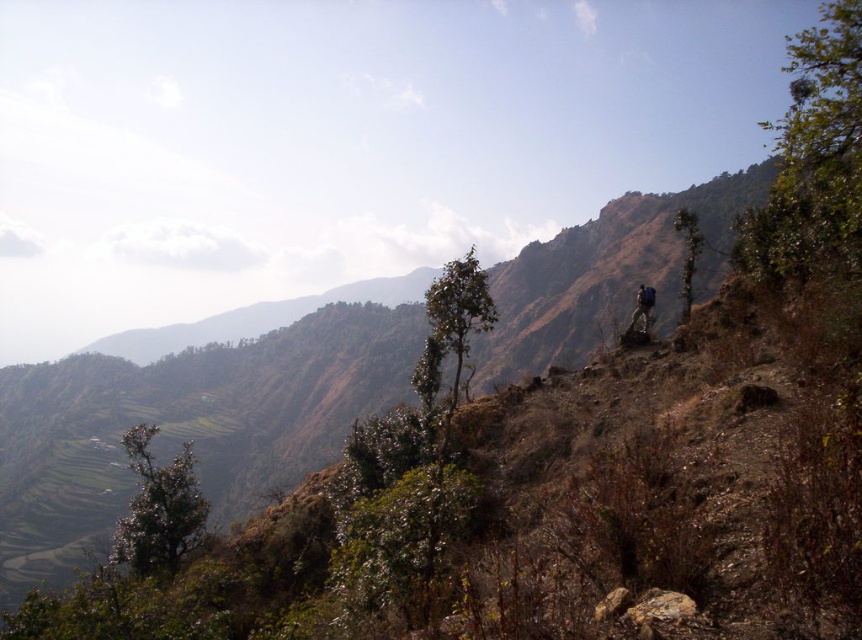
Question: Which point appears farthest from the camera in this image?

Choices:
 (A) pyautogui.click(x=651, y=298)
 (B) pyautogui.click(x=167, y=531)
 (C) pyautogui.click(x=694, y=218)

Answer: (C)

Question: Is green leafy tree at lower left further to the viewer compared to matte black backpack at upper right?

Choices:
 (A) yes
 (B) no

Answer: (B)

Question: Considering the relative positions of green leafy tree at upper right and matte black backpack at upper right in the image provided, where is green leafy tree at upper right located with respect to matte black backpack at upper right?

Choices:
 (A) right
 (B) left

Answer: (A)

Question: Based on their relative distances, which object is nearer to the green leafy tree at upper right?

Choices:
 (A) matte black backpack at upper right
 (B) green leafy tree at lower left

Answer: (A)

Question: Which point is farther to the camera?

Choices:
 (A) green leafy tree at lower left
 (B) green leafy tree at upper right

Answer: (B)

Question: Can you confirm if green leafy tree at upper right is positioned to the right of matte black backpack at upper right?

Choices:
 (A) yes
 (B) no

Answer: (A)